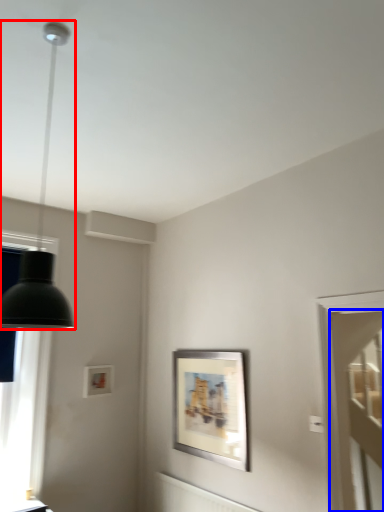
Question: Which object appears closest to the camera in this image, lamp (highlighted by a red box) or glass door (highlighted by a blue box)?

Choices:
 (A) lamp
 (B) glass door

Answer: (A)